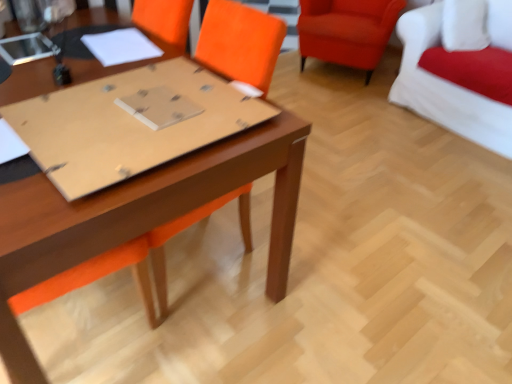
The image size is (512, 384). I want to click on vacant space to the left of white fabric couch at upper right, marked as the second chair in a left-to-right arrangement, so click(354, 118).